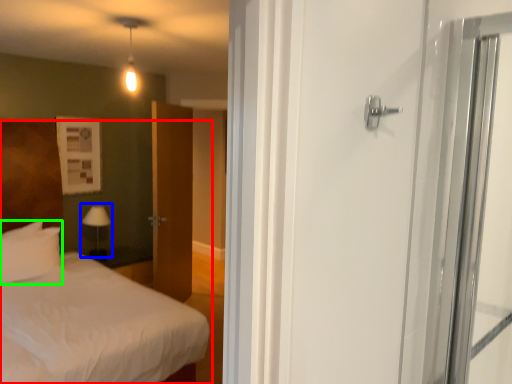
Question: Considering the real-world distances, which object is farthest from bed (highlighted by a red box)? table lamp (highlighted by a blue box) or pillow (highlighted by a green box)?

Choices:
 (A) table lamp
 (B) pillow

Answer: (A)